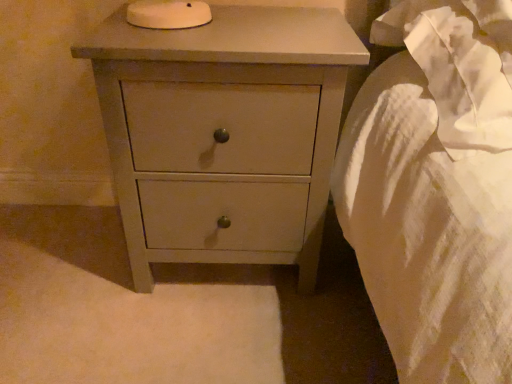
Where is `vacant area on top of matte gray chest of drawers at center (from a real-world perspective)`? The height and width of the screenshot is (384, 512). vacant area on top of matte gray chest of drawers at center (from a real-world perspective) is located at coordinates (238, 28).